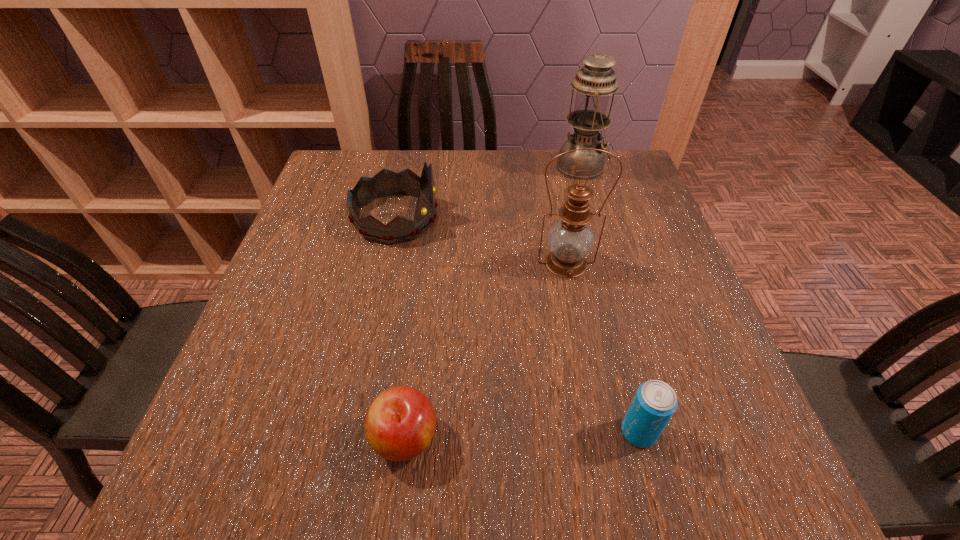
You are a GUI agent. You are given a task and a screenshot of the screen. Output one action in this format:
    pyautogui.click(x=<x>, y=<y>)
    Task: Click on the vacant area in the image that satisfies the following two spatial constraints: 1. on the back side of the farthest object; 2. on the left side of the soda can
    
    Given the screenshot: What is the action you would take?
    pyautogui.click(x=570, y=167)

Find the location of a particular element. vacant position in the image that satisfies the following two spatial constraints: 1. on the back side of the apple; 2. at the front of the fourth nearest object with jewels is located at coordinates (432, 218).